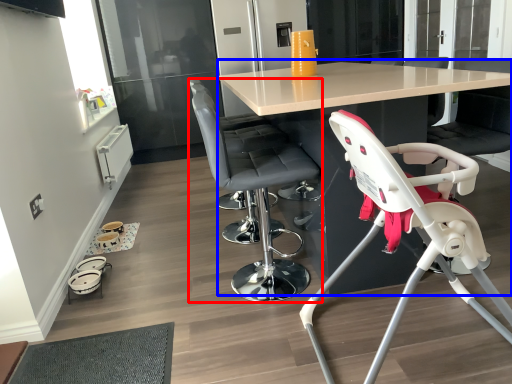
Question: Which of the following is the closest to the observer, chair (highlighted by a red box) or table (highlighted by a blue box)?

Choices:
 (A) chair
 (B) table

Answer: (B)